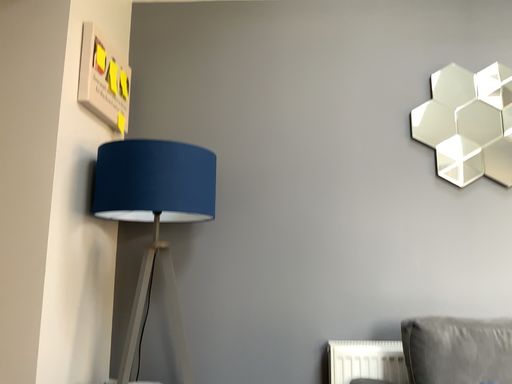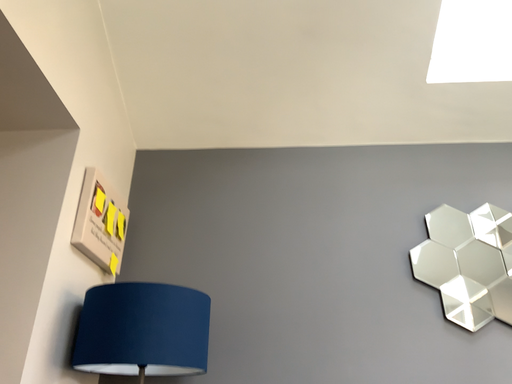
Question: Which way did the camera rotate in the video?

Choices:
 (A) rotated upward
 (B) rotated downward

Answer: (A)